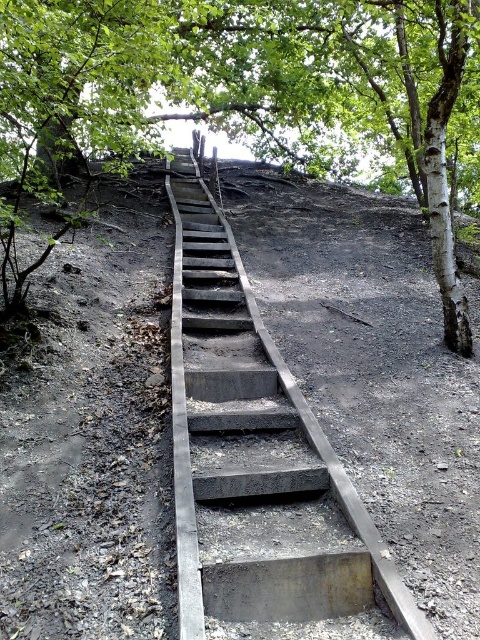
Does green leafy tree at upper center have a greater width compared to concrete/steps at center?

Yes, green leafy tree at upper center is wider than concrete/steps at center.

Between green leafy tree at upper center and concrete/steps at center, which one has more height?

With more height is green leafy tree at upper center.

Is point (44, 99) positioned before point (197, 410)?

Yes, point (44, 99) is in front of point (197, 410).

Find the location of `green leafy tree at upper center`. green leafy tree at upper center is located at coordinates (236, 97).